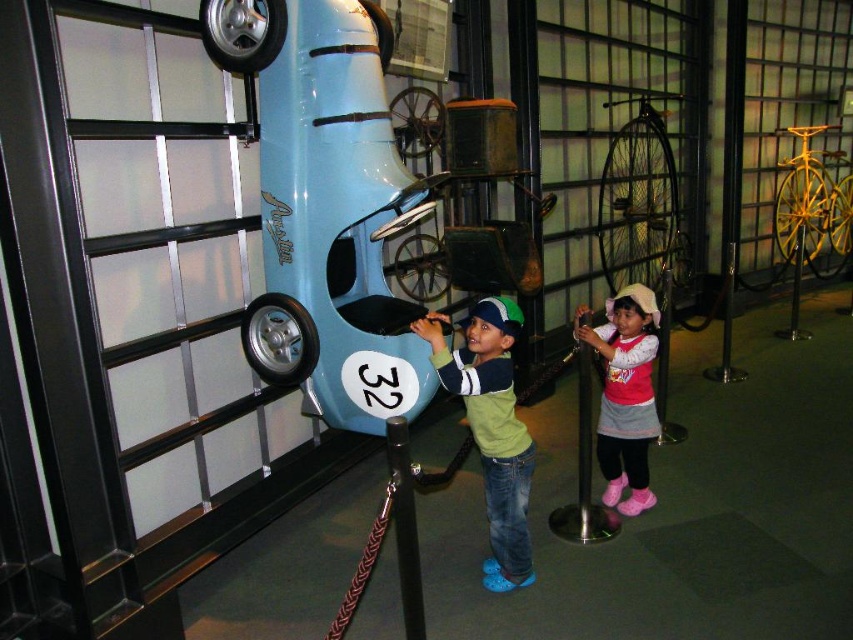
Is green matte shirt at center bigger than pink fabric dress at lower right?

No.

Is point (415, 323) closer to camera compared to point (613, 440)?

Yes, it is in front of point (613, 440).

Where is `green matte shirt at center`? Image resolution: width=853 pixels, height=640 pixels. green matte shirt at center is located at coordinates (491, 428).